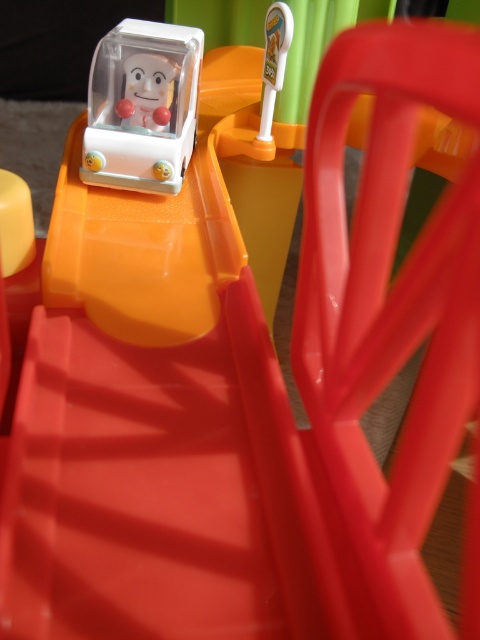
You are a child playing with this toy set and want to place both the matte white toy car at upper left and the matte plastic doll at upper center onto a small shelf. The shelf has limited space, and you can only fit one of them. Which object should you choose to fit on the shelf?

The matte plastic doll at upper center should be placed on the shelf because it is smaller than the matte white toy car at upper left, making it more likely to fit in the limited space.

You are a child playing with this toy train set and want to place both the matte white toy car at upper left and the matte plastic doll at upper center on the track. Which object should you place closer to the train to make them appear aligned from your viewpoint?

You should place the matte white toy car at upper left closer to the train because it is already closer to the viewer than the matte plastic doll at upper center, so positioning them this way will make them appear aligned from your viewpoint.